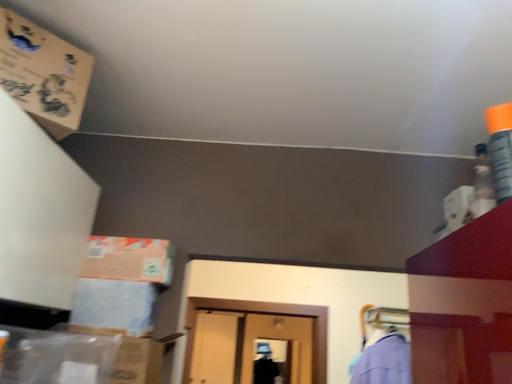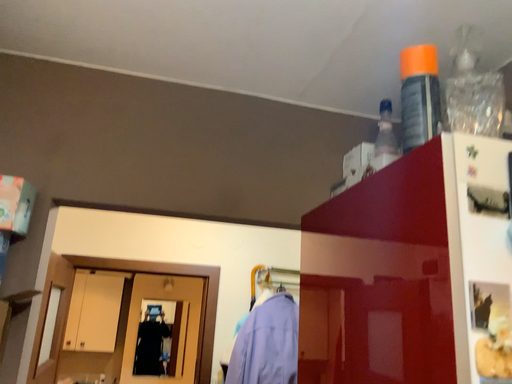
Question: Which way did the camera rotate in the video?

Choices:
 (A) rotated right
 (B) rotated left

Answer: (A)